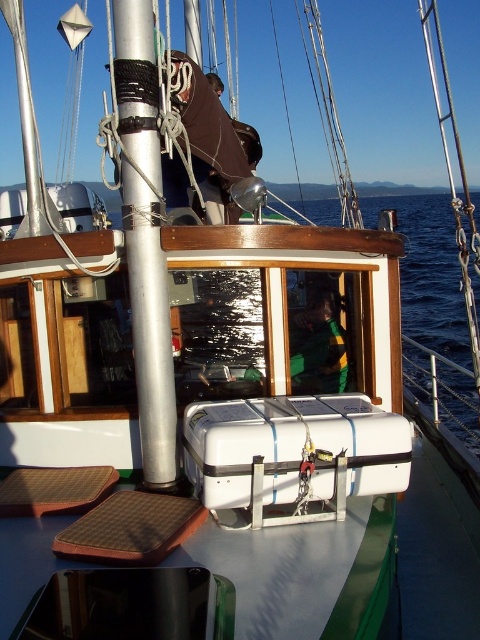
How much distance is there between blue water at center and green fabric at center?

blue water at center and green fabric at center are 6.54 meters apart.

Who is more forward, [453,342] or [327,390]?

Point [327,390]

Between point (441, 262) and point (300, 380), which one is positioned in front?

Point (300, 380) is more forward.

You are a GUI agent. You are given a task and a screenshot of the screen. Output one action in this format:
    pyautogui.click(x=<x>, y=<y>)
    Task: Click on the blue water at center
    
    Given the screenshot: What is the action you would take?
    pyautogui.click(x=434, y=301)

Does silver/metallic mast at center have a greater width compared to brown textured mat at lower left?

In fact, silver/metallic mast at center might be narrower than brown textured mat at lower left.

Which is below, silver/metallic mast at center or brown textured mat at lower left?

brown textured mat at lower left

Between point (141, 6) and point (159, 561), which one is positioned in front?

Point (159, 561) is in front.

Locate an element on the screen. The height and width of the screenshot is (640, 480). silver/metallic mast at center is located at coordinates (144, 237).

Consider the image. Is brown leather seat at upper center closer to the viewer compared to brown textured mat at lower left?

No, brown leather seat at upper center is further to the viewer.

Is brown leather seat at upper center smaller than brown textured mat at lower left?

No, brown leather seat at upper center is not smaller than brown textured mat at lower left.

Identify the location of brown leather seat at upper center. (207, 145).